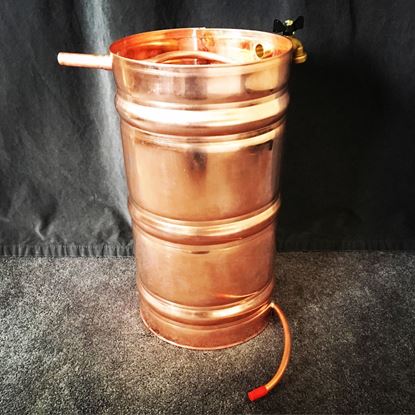
Locate an element on the screen. handle is located at coordinates pyautogui.click(x=85, y=59).